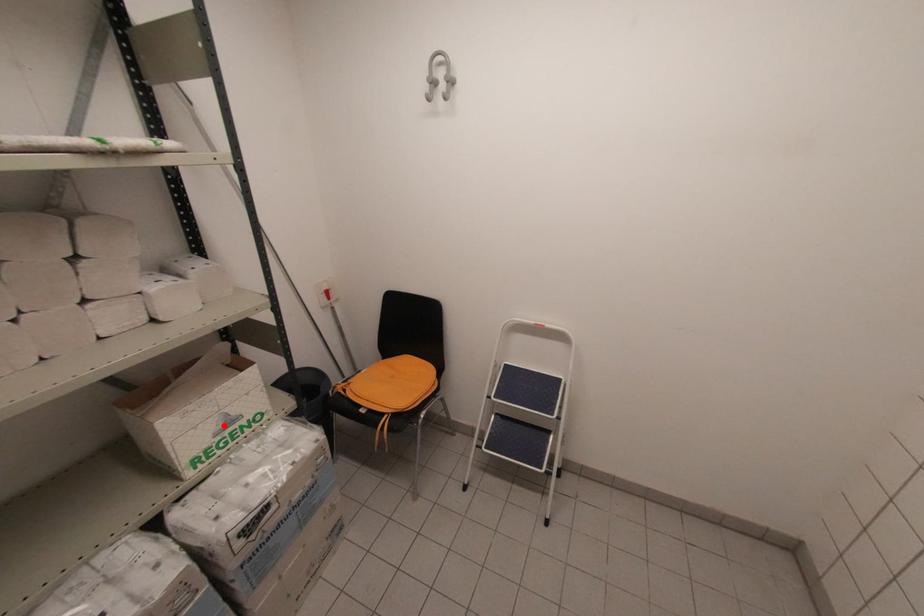
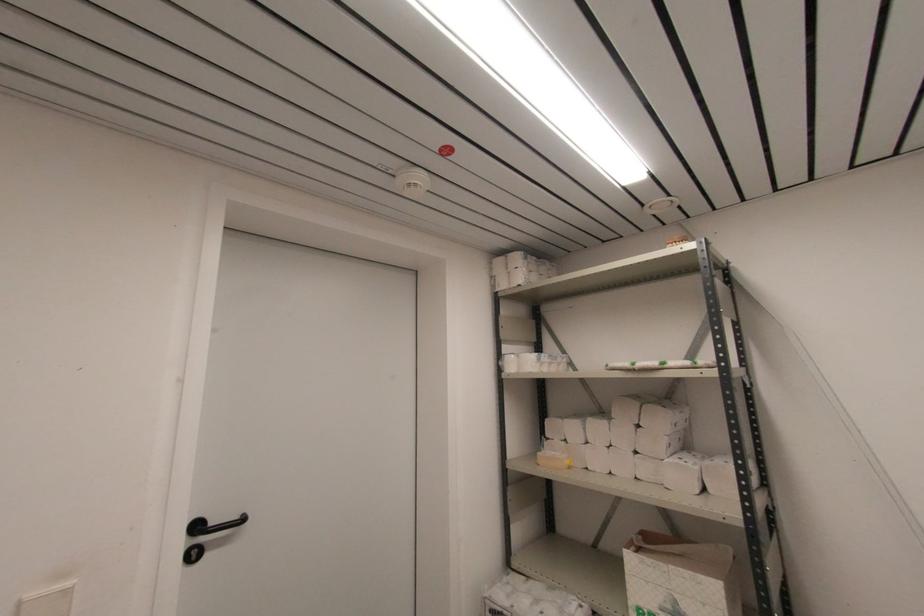
Question: A red point is marked in image1. In image2, is the corresponding 3D point closer to the camera or farther? Reply with the corresponding letter.

Choices:
 (A) The corresponding 3D point is closer.
 (B) The corresponding 3D point is farther.

Answer: (A)